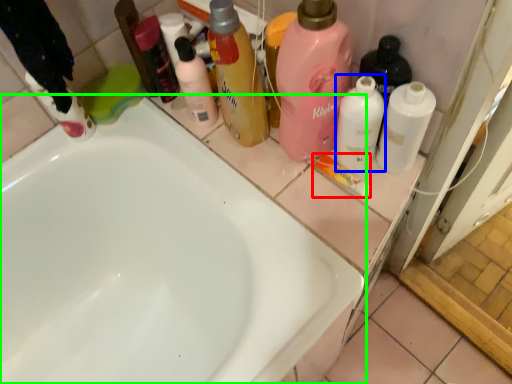
Question: Considering the real-world distances, which object is closest to toothpaste (highlighted by a red box)? cleaning product (highlighted by a blue box) or bathtub (highlighted by a green box).

Choices:
 (A) cleaning product
 (B) bathtub

Answer: (A)